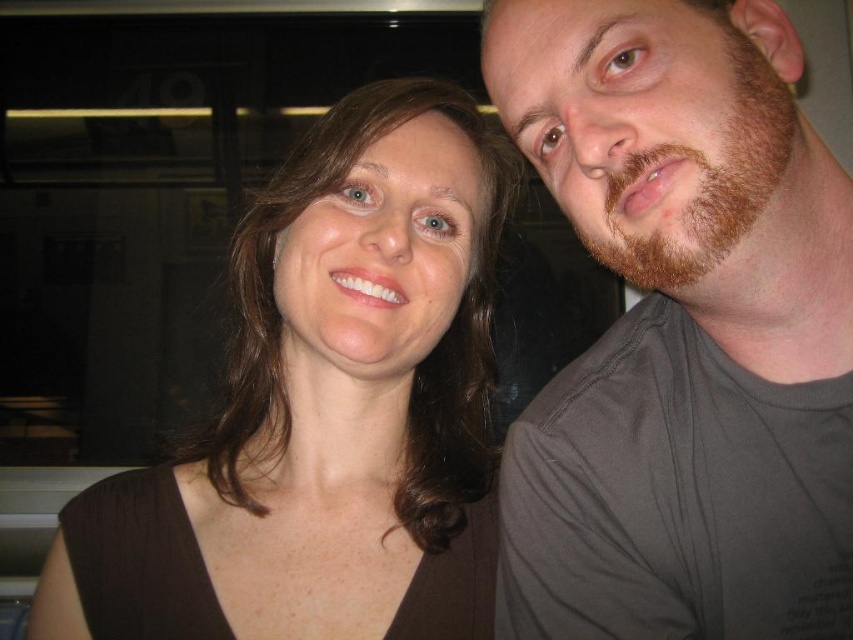
You are a photographer trying to frame a shot of the two subjects. The brown matte shirt at center and the brown fuzzy beard at right are both important elements. Which of these two should you focus on to ensure they fit within a standard portrait frame that prioritizes width?

The brown matte shirt at center should be focused on because it is wider than the brown fuzzy beard at right, ensuring it fits better within the frame.